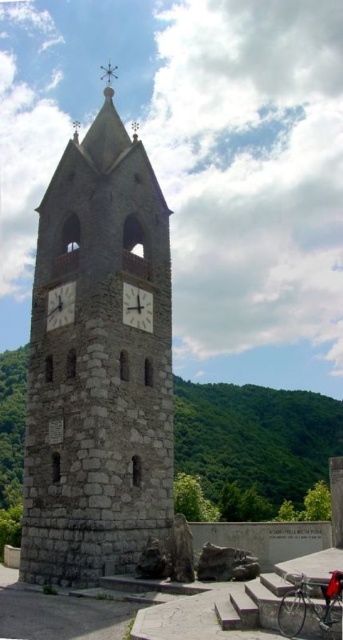
Can you confirm if stone clock tower at center is smaller than white stone clock at center?

No, stone clock tower at center is not smaller than white stone clock at center.

Which is behind, point (87, 369) or point (65, 307)?

Positioned behind is point (65, 307).

What do you see at coordinates (99, 365) in the screenshot? This screenshot has height=640, width=343. I see `stone clock tower at center` at bounding box center [99, 365].

You are a GUI agent. You are given a task and a screenshot of the screen. Output one action in this format:
    pyautogui.click(x=<x>, y=<y>)
    Task: Click on the stone clock tower at center
    This screenshot has width=343, height=640.
    Given the screenshot: What is the action you would take?
    pyautogui.click(x=99, y=365)

The width and height of the screenshot is (343, 640). Identify the location of stone clock tower at center. (99, 365).

You are a GUI agent. You are given a task and a screenshot of the screen. Output one action in this format:
    pyautogui.click(x=<x>, y=<y>)
    Task: Click on the stone clock tower at center
    This screenshot has width=343, height=640.
    Given the screenshot: What is the action you would take?
    pyautogui.click(x=99, y=365)

Image resolution: width=343 pixels, height=640 pixels. In order to click on smooth gray clock at center in this screenshot , I will do `click(136, 307)`.

Can you confirm if smooth gray clock at center is positioned to the left of white stone clock at center?

No, smooth gray clock at center is not to the left of white stone clock at center.

Where is `smooth gray clock at center`? smooth gray clock at center is located at coordinates click(136, 307).

Image resolution: width=343 pixels, height=640 pixels. I want to click on smooth gray clock at center, so click(x=136, y=307).